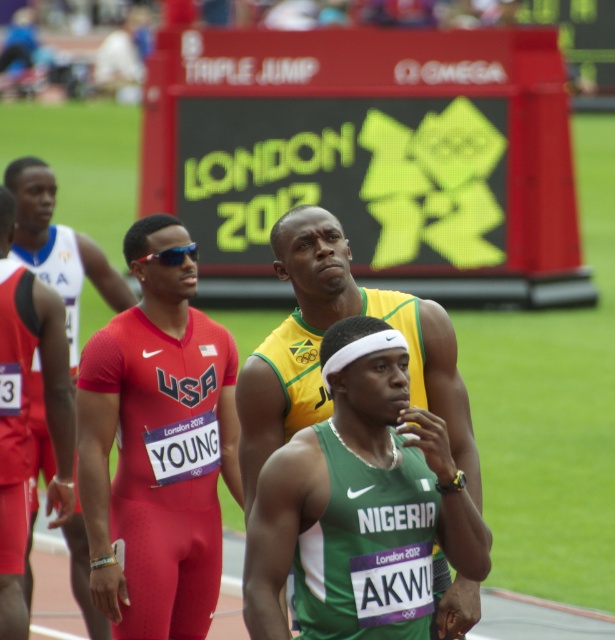
Question: Is matte red uniform at center below sunglasses at center?

Choices:
 (A) yes
 (B) no

Answer: (A)

Question: Which of the following is the closest to the observer?

Choices:
 (A) matte red uniform at center
 (B) sunglasses at center
 (C) red matte uniform at center
 (D) green jersey at center

Answer: (D)

Question: Which object is closer to the camera taking this photo?

Choices:
 (A) sunglasses at center
 (B) green jersey at center
 (C) matte red uniform at center
 (D) red matte uniform at center

Answer: (B)

Question: Can you confirm if green jersey at center is positioned above red matte uniform at center?

Choices:
 (A) yes
 (B) no

Answer: (B)

Question: Which point is farther to the camera?

Choices:
 (A) (175, 252)
 (B) (113, 300)

Answer: (B)

Question: Does red matte uniform at center have a larger size compared to sunglasses at center?

Choices:
 (A) no
 (B) yes

Answer: (B)